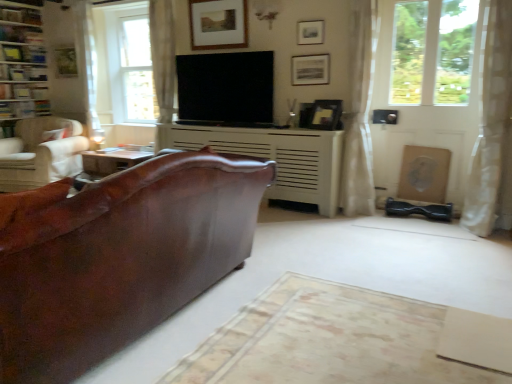
Locate an element on the screen. The width and height of the screenshot is (512, 384). free point below white sheer curtain at right, placed as the 2th curtain when sorted from right to left (from a real-world perspective) is located at coordinates (353, 218).